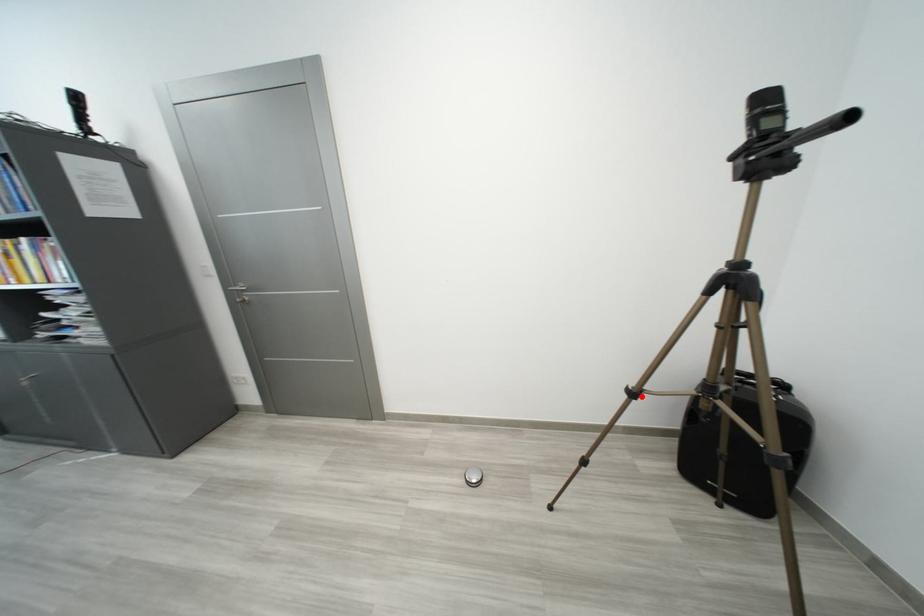
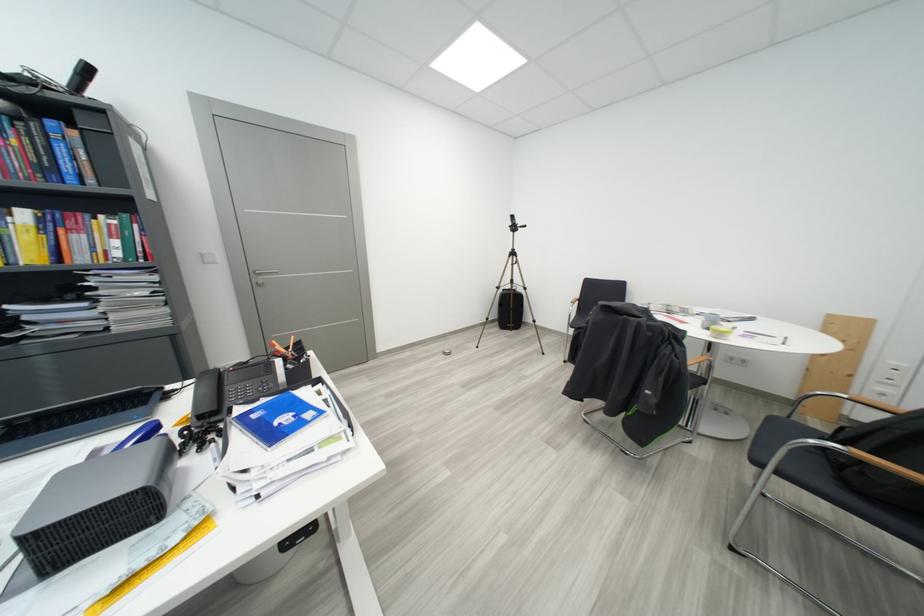
Question: I am providing you with two images of the same scene from different viewpoints. Image1 has a red point marked. In image2, the corresponding 3D location appears at what relative position? Reply with the corresponding letter.

Choices:
 (A) Closer
 (B) Farther

Answer: (A)